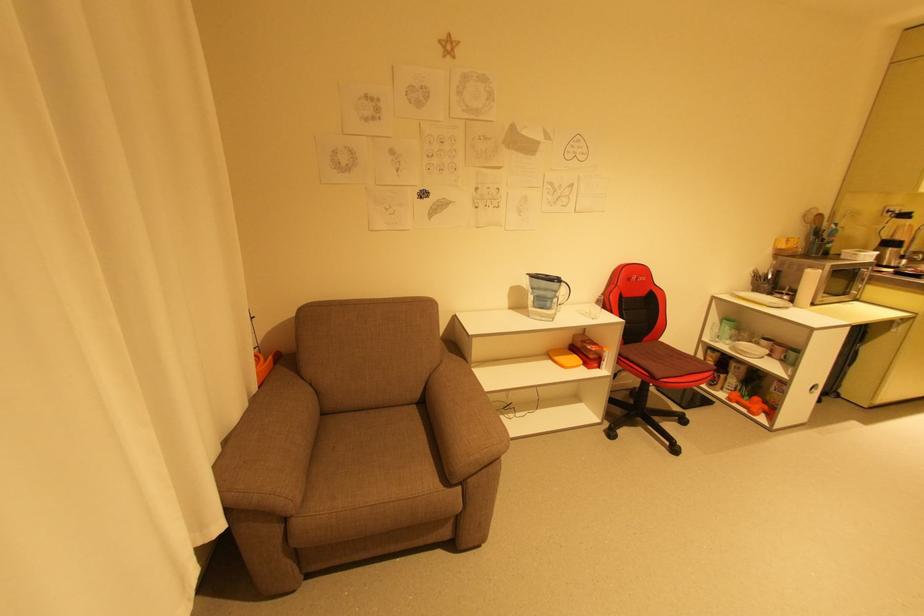
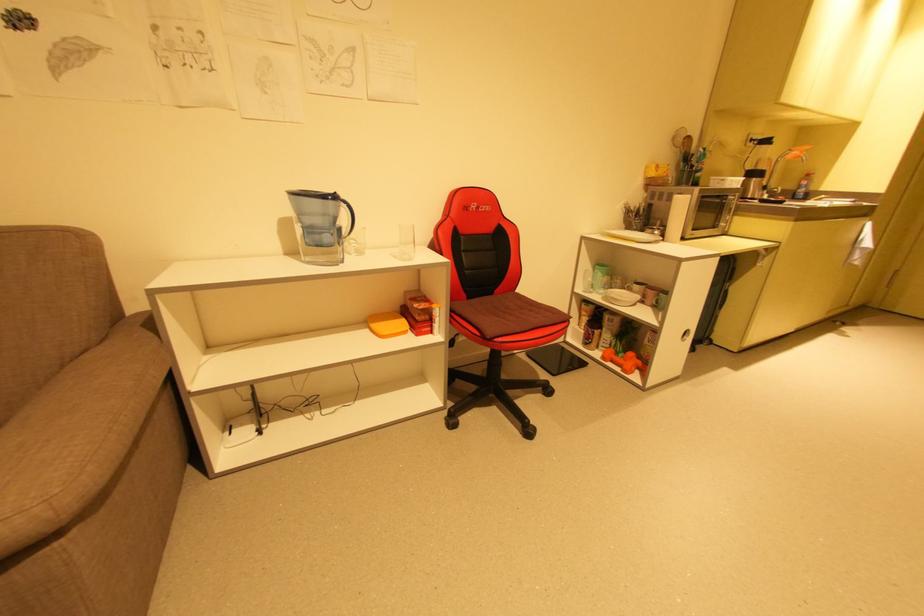
In the second image, find the point that corresponds to pixel 768 415 in the first image.

(641, 371)